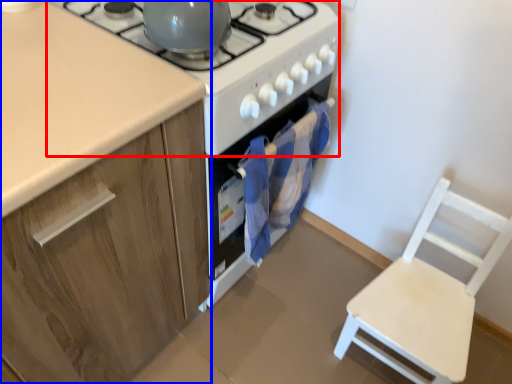
Question: Among these objects, which one is farthest to the camera, gas stove (highlighted by a red box) or cabinetry (highlighted by a blue box)?

Choices:
 (A) gas stove
 (B) cabinetry

Answer: (A)